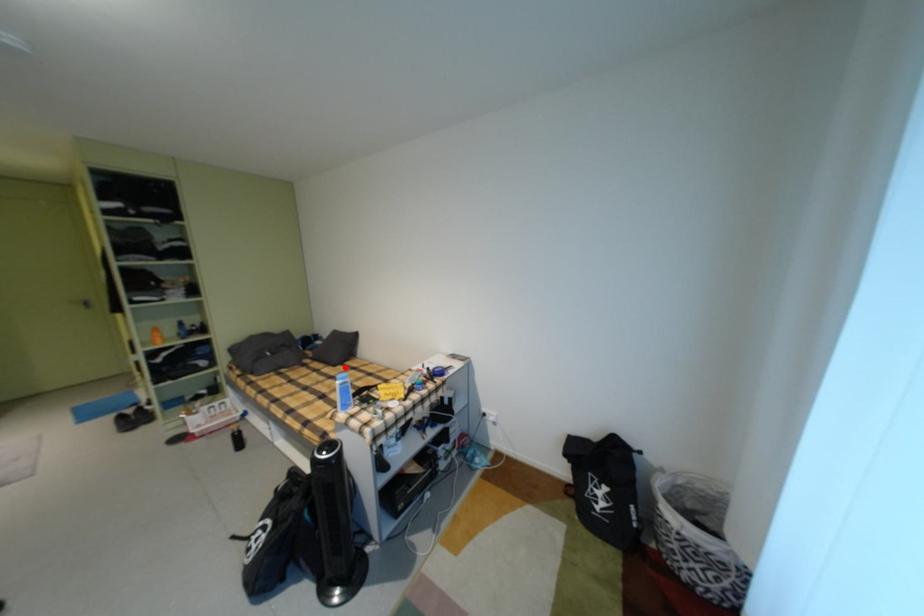
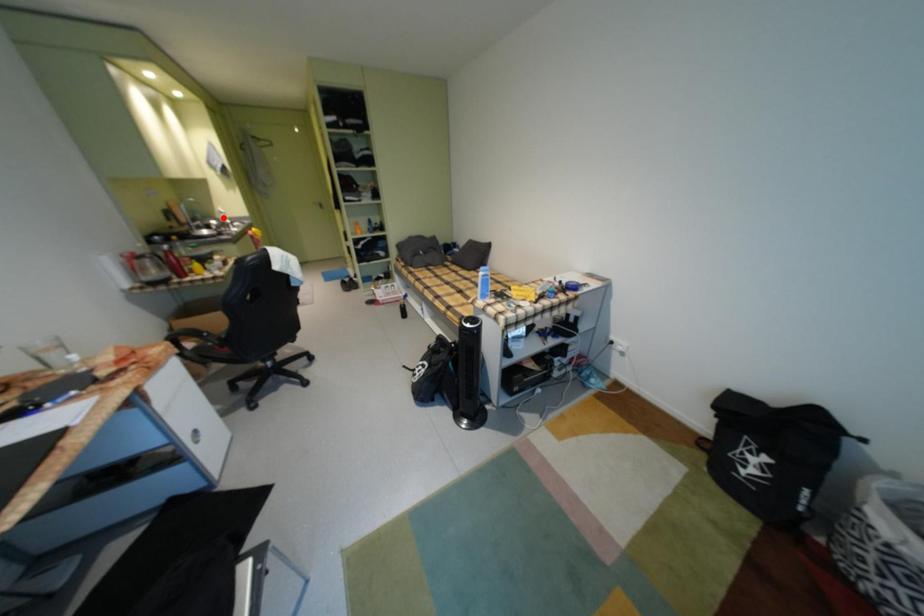
I am providing you with two images of the same scene from different viewpoints. A red point is marked on the first image and another point is marked on the second image. Is the marked point in image1 the same physical position as the marked point in image2?

No